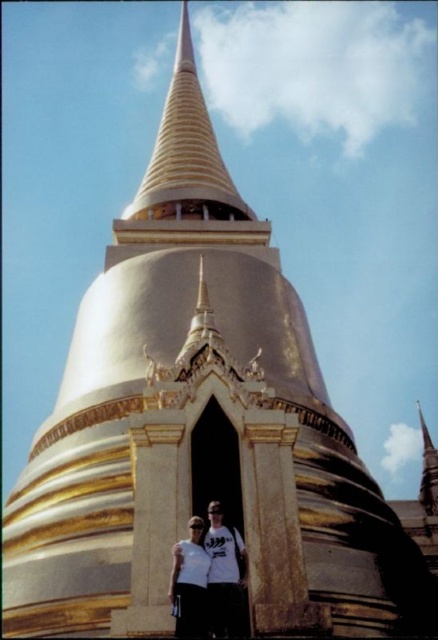
Does gold polished spire at center have a larger size compared to white matte t-shirt at lower center?

Correct, gold polished spire at center is larger in size than white matte t-shirt at lower center.

Can you confirm if gold polished spire at center is thinner than white matte t-shirt at lower center?

No, gold polished spire at center is not thinner than white matte t-shirt at lower center.

Describe the element at coordinates (186, 145) in the screenshot. I see `gold polished spire at center` at that location.

You are a GUI agent. You are given a task and a screenshot of the screen. Output one action in this format:
    pyautogui.click(x=<x>, y=<y>)
    Task: Click on the gold polished spire at center
    This screenshot has height=640, width=438.
    Given the screenshot: What is the action you would take?
    pyautogui.click(x=186, y=145)